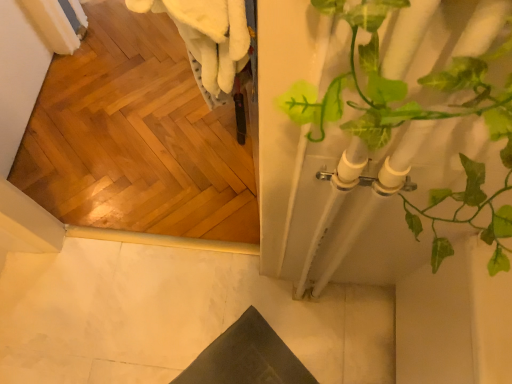
Question: From a real-world perspective, is white marble floor at lower left above or below green leafy plant at right?

Choices:
 (A) below
 (B) above

Answer: (A)

Question: From the image's perspective, is white marble floor at lower left located above or below green leafy plant at right?

Choices:
 (A) below
 (B) above

Answer: (A)

Question: Is white marble floor at lower left in front of or behind green leafy plant at right in the image?

Choices:
 (A) behind
 (B) front

Answer: (A)

Question: In the image, is green leafy plant at right positioned in front of or behind white marble floor at lower left?

Choices:
 (A) behind
 (B) front

Answer: (B)

Question: Visually, is green leafy plant at right positioned to the left or to the right of white marble floor at lower left?

Choices:
 (A) left
 (B) right

Answer: (B)

Question: Is green leafy plant at right bigger or smaller than white marble floor at lower left?

Choices:
 (A) small
 (B) big

Answer: (B)

Question: Is point (459, 125) positioned closer to the camera than point (140, 291)?

Choices:
 (A) farther
 (B) closer

Answer: (B)